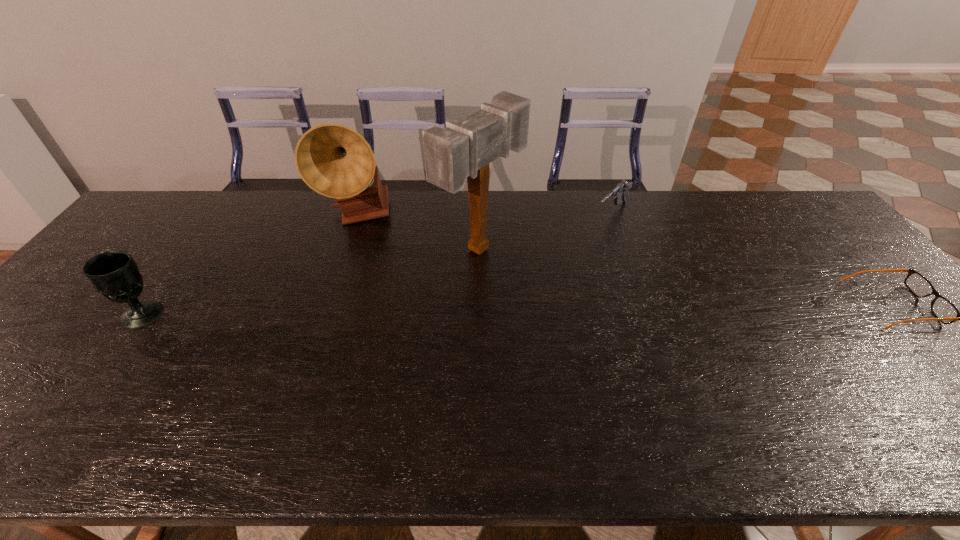
Locate an element on the screen. This screenshot has height=540, width=960. chalice is located at coordinates (114, 274).

Where is `the third shortest object`? the third shortest object is located at coordinates (114, 274).

Where is `the shortest object`? This screenshot has width=960, height=540. the shortest object is located at coordinates (945, 311).

Where is `spectacles`? The width and height of the screenshot is (960, 540). spectacles is located at coordinates (945, 311).

Where is `mallet`? Image resolution: width=960 pixels, height=540 pixels. mallet is located at coordinates (462, 150).

The image size is (960, 540). Find the location of `gun`. gun is located at coordinates (620, 191).

The height and width of the screenshot is (540, 960). I want to click on the second shortest object, so click(x=620, y=191).

The image size is (960, 540). In order to click on the fourth object from right to left in this screenshot , I will do `click(335, 161)`.

This screenshot has width=960, height=540. What are the coordinates of `the second tallest object` in the screenshot? It's located at (335, 161).

Find the location of a particular element. This screenshot has width=960, height=540. free point located on the right of the third tallest object is located at coordinates (213, 314).